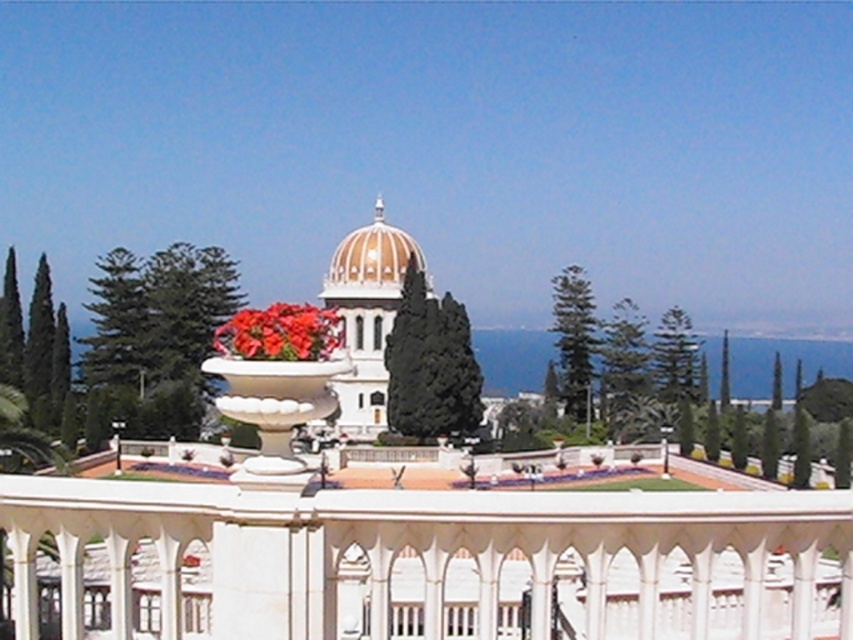
Is the position of dark green textured cypress tree at center less distant than that of matte orange dome at center?

That is True.

Does point (422, 380) lie in front of point (422, 269)?

Yes, point (422, 380) is in front of point (422, 269).

This screenshot has height=640, width=853. Identify the location of dark green textured cypress tree at center. (430, 364).

Does glossy ceramic flowers at center have a lesser width compared to green textured cypress tree at center-right?

In fact, glossy ceramic flowers at center might be wider than green textured cypress tree at center-right.

Is glossy ceramic flowers at center below green textured cypress tree at center-right?

Incorrect, glossy ceramic flowers at center is not positioned below green textured cypress tree at center-right.

Who is more forward, (274, 348) or (589, 417)?

Point (274, 348)

This screenshot has width=853, height=640. Find the location of `glossy ceramic flowers at center`. glossy ceramic flowers at center is located at coordinates (280, 333).

Which is above, matte orange dome at center or green textured cypress tree at center-right?

matte orange dome at center

Can you confirm if matte orange dome at center is positioned to the left of green textured cypress tree at center-right?

Yes, matte orange dome at center is to the left of green textured cypress tree at center-right.

Measure the distance between matte orange dome at center and camera.

matte orange dome at center is 110.07 meters from camera.

The image size is (853, 640). I want to click on matte orange dome at center, so click(x=370, y=260).